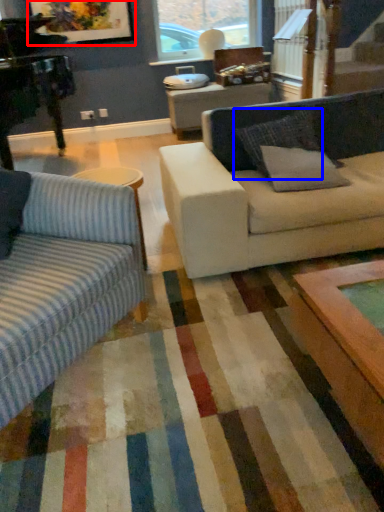
Question: Which point is closer to the camera, picture frame (highlighted by a red box) or pillow (highlighted by a blue box)?

Choices:
 (A) picture frame
 (B) pillow

Answer: (B)